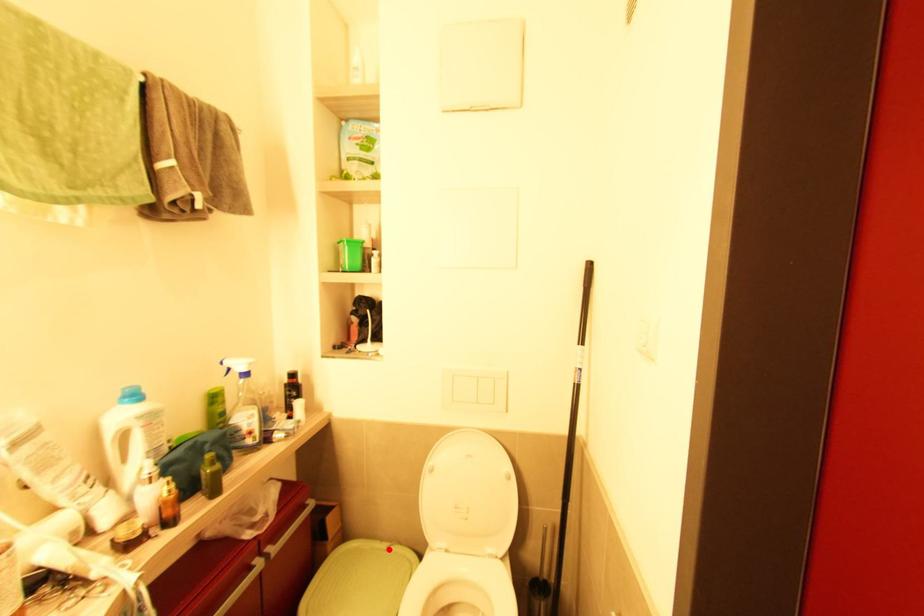
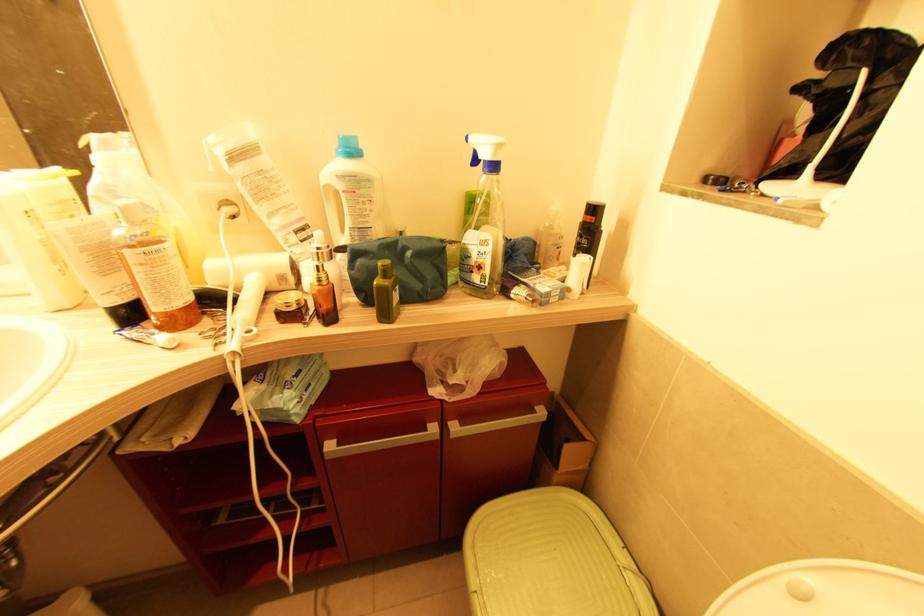
Where in the second image is the point corresponding to the highlighted location from the first image?

(626, 570)